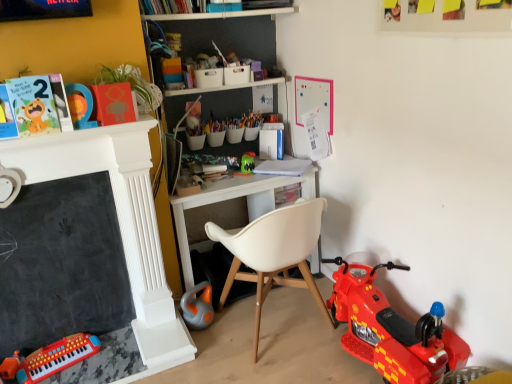
Question: Is point (298, 172) positioned closer to the camera than point (247, 165)?

Choices:
 (A) farther
 (B) closer

Answer: (B)

Question: From a real-world perspective, is white paper at center, the first book in the right-to-left sequence, above or below green plastic toy at center, the fifth toy from the left?

Choices:
 (A) above
 (B) below

Answer: (B)

Question: Which object is positioned closest to the matte plastic number at upper left, marked as the third toy in a left-to-right arrangement?

Choices:
 (A) matte paper card at upper left, which is the 3th book from back to front
 (B) white matte chair at center
 (C) white paper at center, which is the third book from front to back
 (D) plastic keyboard at lower left, the 5th toy from the right
 (E) matte orange book at upper left, which is counted as the second book, starting from the front

Answer: (E)

Question: Estimate the real-world distances between objects in this image. Which object is farther from the green plastic toy at center, the fifth toy from the left?

Choices:
 (A) shiny plastic toy motorcycle at lower right, positioned as the first toy in right-to-left order
 (B) white plastic desk at center
 (C) matte orange book at upper left, which is the second book in back-to-front order
 (D) matte paper card at upper left, which is the 3th book from back to front
 (E) matte plastic number at upper left, marked as the third toy in a left-to-right arrangement

Answer: (D)